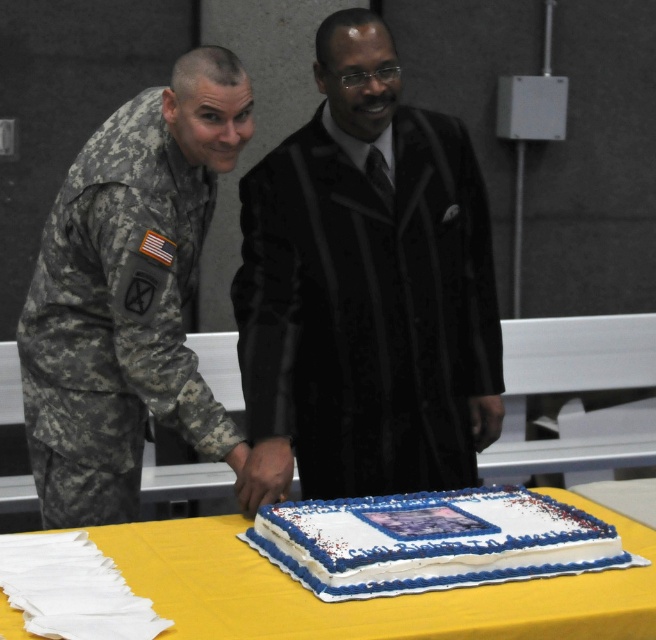
Question: Does black silk suit at center have a smaller size compared to white frosted sheet cake at center?

Choices:
 (A) no
 (B) yes

Answer: (A)

Question: Which point appears closest to the camera in this image?

Choices:
 (A) (607, 628)
 (B) (392, 541)
 (C) (289, 449)
 (D) (91, 157)

Answer: (A)

Question: Which point appears farthest from the camera in this image?

Choices:
 (A) (495, 608)
 (B) (451, 355)
 (C) (361, 540)

Answer: (B)

Question: Among these objects, which one is nearest to the camera?

Choices:
 (A) white frosted cake at center
 (B) black silk suit at center

Answer: (A)

Question: From the image, what is the correct spatial relationship of white frosted cake at center in relation to white frosted sheet cake at center?

Choices:
 (A) below
 (B) above

Answer: (A)

Question: Does black silk suit at center appear on the left side of camouflage fabric uniform at left?

Choices:
 (A) no
 (B) yes

Answer: (A)